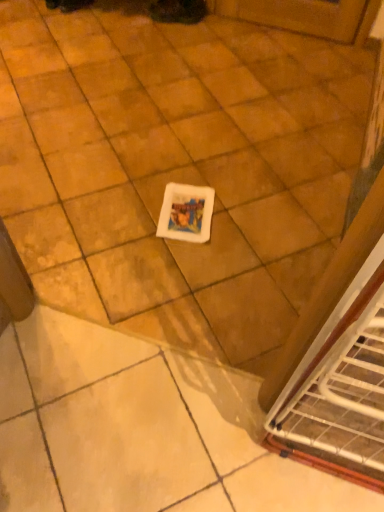
Locate an element on the screen. Image resolution: width=384 pixels, height=512 pixels. free space in front of matte black shoe at upper center is located at coordinates (174, 31).